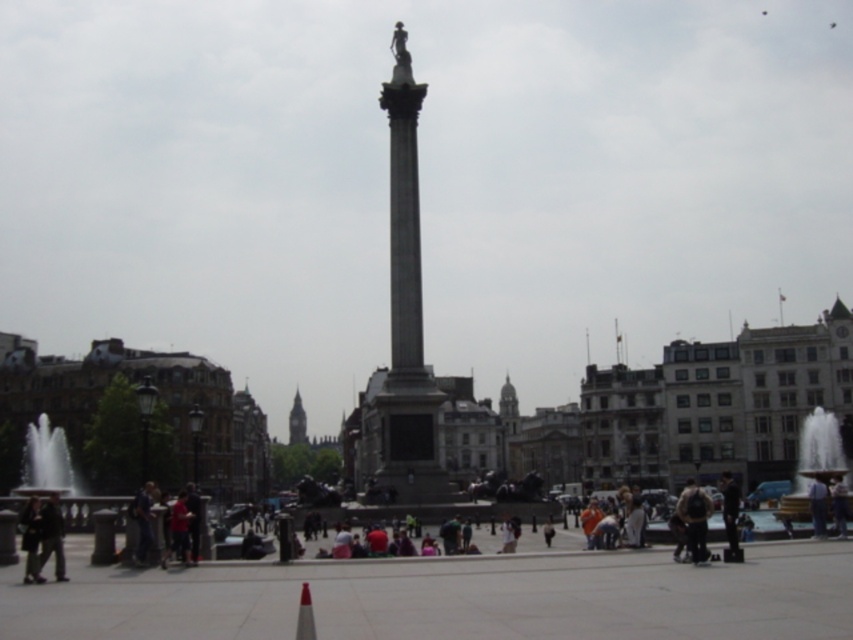
Question: Which is farther from the light brown leather jacket at center?

Choices:
 (A) dark gray pants at lower right
 (B) white marble fountain at lower left

Answer: (B)

Question: Can you confirm if dark gray pants at lower right is positioned to the left of light brown leather jacket at center?

Choices:
 (A) yes
 (B) no

Answer: (A)

Question: Among these points, which one is nearest to the camera?

Choices:
 (A) (33, 436)
 (B) (32, 506)

Answer: (B)

Question: Considering the real-world distances, which object is farthest from the red plastic cone at lower center?

Choices:
 (A) stone clock tower at center
 (B) light brown leather jacket at center

Answer: (A)

Question: In this image, where is gray stone column at center located relative to brown leather jacket at lower right?

Choices:
 (A) right
 (B) left

Answer: (B)

Question: Does gold metallic fountain at lower right come in front of stone clock tower at center?

Choices:
 (A) yes
 (B) no

Answer: (A)